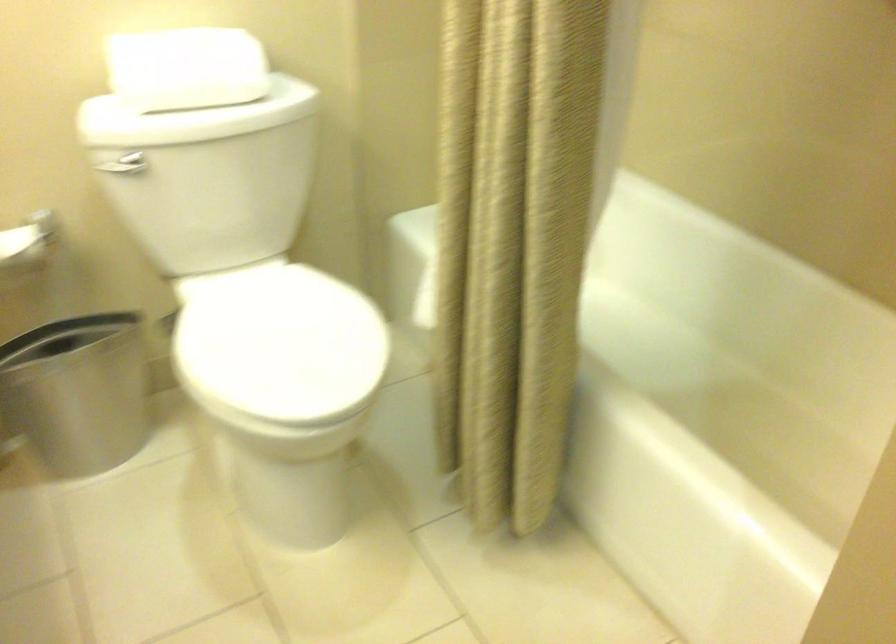
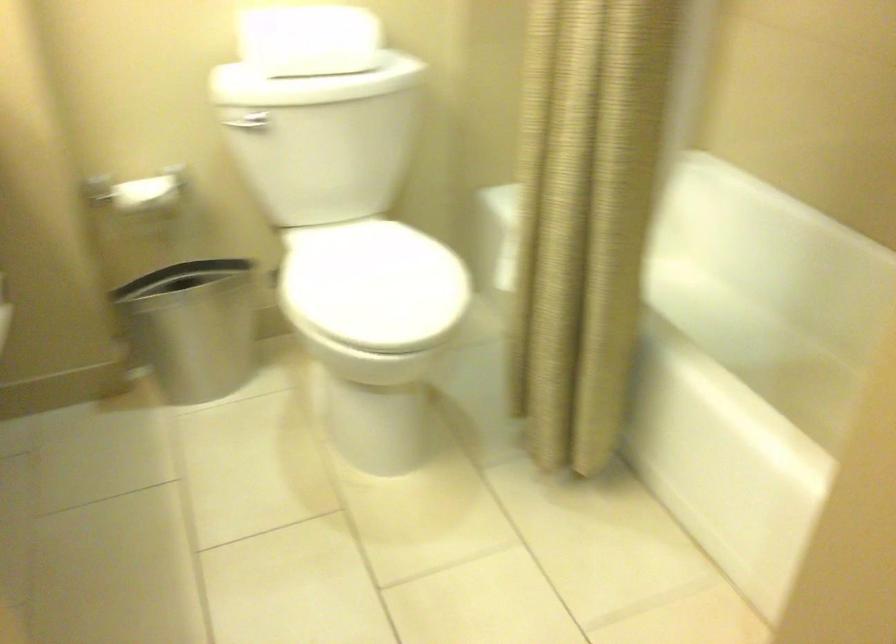
Find the pixel in the second image that matches (74,393) in the first image.

(194, 327)